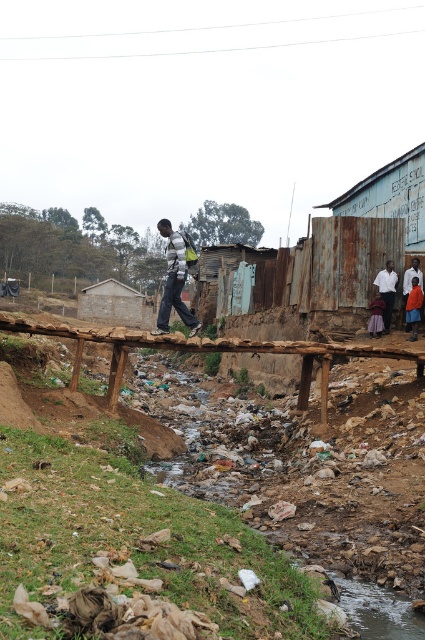
Between brown wooden bridge at center and orange fabric skirt at lower right, which one is positioned lower?

brown wooden bridge at center is below.

Is brown wooden bridge at center closer to camera compared to orange fabric skirt at lower right?

That is True.

At what (x,y) coordinates should I click in order to perform the action: click on brown wooden bridge at center. Please return your answer as a coordinate pair (x, y). The width and height of the screenshot is (425, 640). Looking at the image, I should click on (206, 349).

Is point (391, 288) more distant than point (414, 308)?

Yes, point (391, 288) is farther from viewer.

Which of these two, white shirt at right or orange fabric skirt at lower right, stands taller?

Standing taller between the two is white shirt at right.

Which is in front, point (385, 280) or point (410, 308)?

Point (410, 308)

Identify the location of white shirt at right. This screenshot has width=425, height=640. (387, 291).

Who is positioned more to the right, striped sweater at center or white shirt at right?

Positioned to the right is white shirt at right.

Who is lower down, striped sweater at center or white shirt at right?

white shirt at right

Who is more distant from viewer, (175, 241) or (379, 278)?

The point (379, 278) is more distant.

The height and width of the screenshot is (640, 425). Find the location of `striped sweater at center`. striped sweater at center is located at coordinates (175, 278).